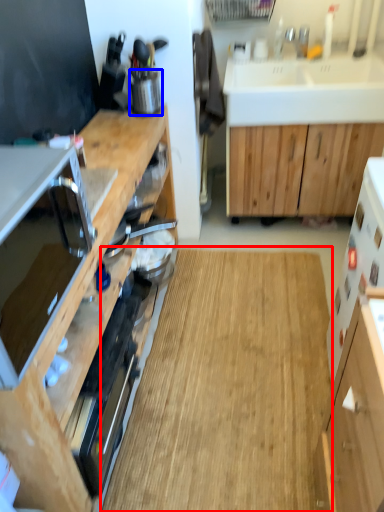
Question: Among these objects, which one is nearest to the camera, hardwood (highlighted by a red box) or appliance (highlighted by a blue box)?

Choices:
 (A) hardwood
 (B) appliance

Answer: (A)